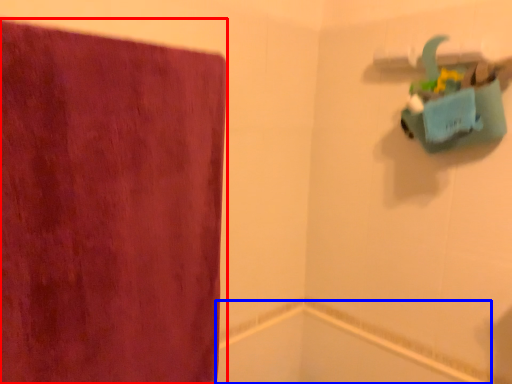
Question: Which object appears closest to the camera in this image, towel (highlighted by a red box) or bath (highlighted by a blue box)?

Choices:
 (A) towel
 (B) bath

Answer: (A)